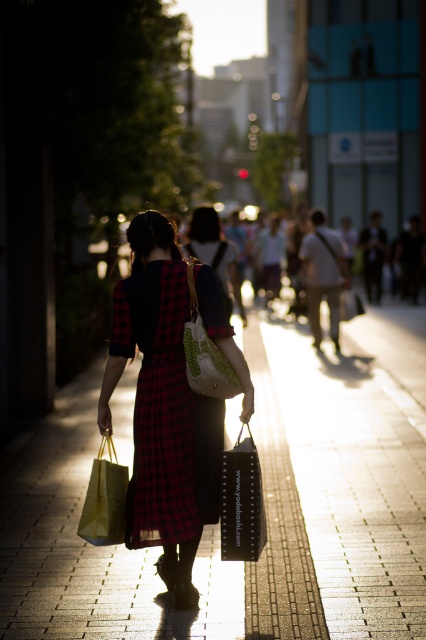
You are a delivery drone that needs to land on the brick pavement at center. The green textured fabric handbag at center is currently occupying part of the landing zone. Can you land safely without touching the handbag?

The brick pavement at center has a larger size compared to green textured fabric handbag at center, so there should be enough space to land safely without touching the handbag.

What are the coordinates of the brick pavement at center?

The coordinates of the brick pavement at center are at point (347, 465).

You are a delivery person who needs to deliver a package to the woman in the image. The package must be placed at the exact location of the point marked at coordinates point [241,500]. However, the woman is holding two shopping bags in her hands. Can you determine which shopping bag the package will land closest to?

The point [241,500] corresponds to the black matte shopping bag at center, so the package will land closest to the black matte shopping bag at center.